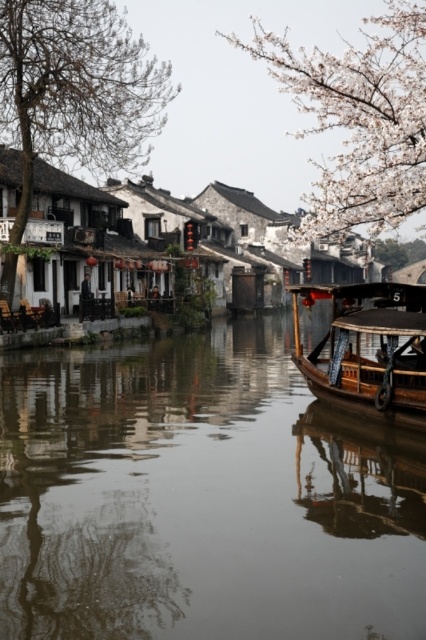
Does smooth brown water at center appear on the right side of white blossoming branches at upper right?

Incorrect, smooth brown water at center is not on the right side of white blossoming branches at upper right.

Between smooth brown water at center and white blossoming branches at upper right, which one is positioned higher?

Positioned higher is white blossoming branches at upper right.

You are a GUI agent. You are given a task and a screenshot of the screen. Output one action in this format:
    pyautogui.click(x=<x>, y=<y>)
    Task: Click on the smooth brown water at center
    The height and width of the screenshot is (640, 426).
    Given the screenshot: What is the action you would take?
    pyautogui.click(x=201, y=497)

I want to click on smooth brown water at center, so click(x=201, y=497).

Is white blossoming branches at upper right wider than wooden boat at right?

Indeed, white blossoming branches at upper right has a greater width compared to wooden boat at right.

Consider the image. Does white blossoming branches at upper right have a greater height compared to wooden boat at right?

Indeed, white blossoming branches at upper right has a greater height compared to wooden boat at right.

Is point (397, 68) positioned in front of point (307, 362)?

No, (397, 68) is behind (307, 362).

I want to click on white blossoming branches at upper right, so click(359, 116).

Does bare branches at left have a smaller size compared to white blossoming branches at upper right?

Correct, bare branches at left occupies less space than white blossoming branches at upper right.

Is bare branches at left positioned at the back of white blossoming branches at upper right?

Yes.

Who is more distant from viewer, (28, 145) or (339, 74)?

Point (28, 145)

Identify the location of bare branches at left. (74, 93).